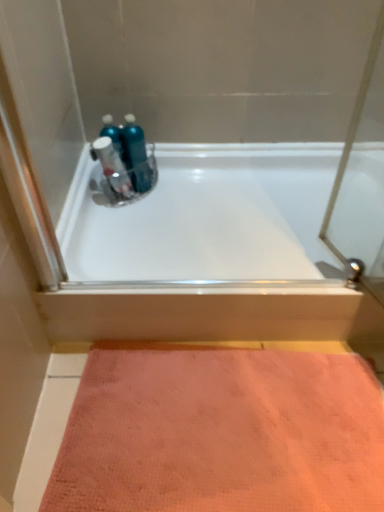
Question: Can we say blue glossy mouthwash at center lies outside white glossy bathtub at upper center?

Choices:
 (A) yes
 (B) no

Answer: (A)

Question: Considering the relative sizes of blue glossy mouthwash at center and white glossy bathtub at upper center in the image provided, is blue glossy mouthwash at center bigger than white glossy bathtub at upper center?

Choices:
 (A) yes
 (B) no

Answer: (B)

Question: Is blue glossy mouthwash at center facing towards white glossy bathtub at upper center?

Choices:
 (A) no
 (B) yes

Answer: (A)

Question: From a real-world perspective, is blue glossy mouthwash at center on white glossy bathtub at upper center?

Choices:
 (A) no
 (B) yes

Answer: (B)

Question: Is blue glossy mouthwash at center far from white glossy bathtub at upper center?

Choices:
 (A) no
 (B) yes

Answer: (A)

Question: From the image's perspective, relative to metallic blue spray bottle at upper center, is blue glossy mouthwash at center above or below?

Choices:
 (A) above
 (B) below

Answer: (A)

Question: Choose the correct answer: Is blue glossy mouthwash at center inside metallic blue spray bottle at upper center or outside it?

Choices:
 (A) inside
 (B) outside

Answer: (B)

Question: Considering their positions, is blue glossy mouthwash at center located in front of or behind metallic blue spray bottle at upper center?

Choices:
 (A) behind
 (B) front

Answer: (A)

Question: Is blue glossy mouthwash at center to the left or to the right of metallic blue spray bottle at upper center in the image?

Choices:
 (A) left
 (B) right

Answer: (B)

Question: Visually, is white glossy bathtub at upper center positioned to the left or to the right of metallic blue spray bottle at upper center?

Choices:
 (A) left
 (B) right

Answer: (B)

Question: Based on their sizes in the image, would you say white glossy bathtub at upper center is bigger or smaller than metallic blue spray bottle at upper center?

Choices:
 (A) big
 (B) small

Answer: (A)

Question: Considering the positions of point (100, 172) and point (130, 189), is point (100, 172) closer or farther from the camera than point (130, 189)?

Choices:
 (A) closer
 (B) farther

Answer: (A)

Question: From a real-world perspective, relative to metallic blue spray bottle at upper center, is white glossy bathtub at upper center vertically above or below?

Choices:
 (A) below
 (B) above

Answer: (A)

Question: Is pink textured mat at lower center taller or shorter than white glossy bathtub at upper center?

Choices:
 (A) tall
 (B) short

Answer: (B)

Question: Do you think pink textured mat at lower center is within white glossy bathtub at upper center, or outside of it?

Choices:
 (A) inside
 (B) outside

Answer: (B)